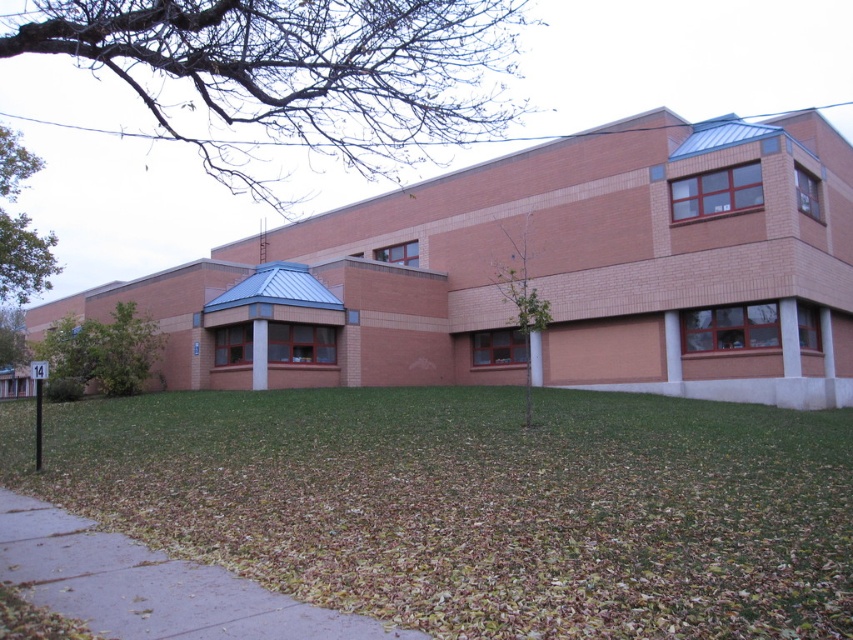
You are standing in front of the two story brick building and want to walk to the green grass at lower center. Which direction should you move from the brown concrete sidewalk at lower left?

The green grass at lower center is positioned on the right side of the brown concrete sidewalk at lower left, so you should move to the right from the brown concrete sidewalk at lower left to reach the green grass at lower center.